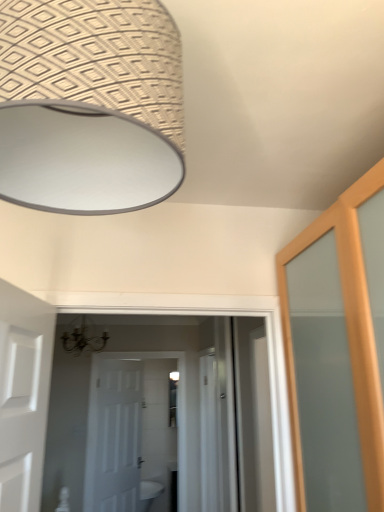
You are a GUI agent. You are given a task and a screenshot of the screen. Output one action in this format:
    pyautogui.click(x=<x>, y=<y>)
    Task: Click on the white glossy sink at lower center
    This screenshot has width=384, height=512.
    Given the screenshot: What is the action you would take?
    pyautogui.click(x=149, y=493)

What do you see at coordinates (149, 493) in the screenshot? This screenshot has width=384, height=512. I see `white glossy sink at lower center` at bounding box center [149, 493].

In the scene shown: Measure the distance between point [211,470] and camera.

Point [211,470] is 3.76 meters from camera.

The height and width of the screenshot is (512, 384). Describe the element at coordinates (118, 436) in the screenshot. I see `white matte door at center` at that location.

Measure the distance between white matte door at center and camera.

They are 3.59 meters apart.

Locate an element on the screen. This screenshot has height=512, width=384. white glossy sink at lower center is located at coordinates (149, 493).

Find the location of a particular element. sink on the left of white glossy screen door at center is located at coordinates (149, 493).

Is point (203, 361) farther from viewer compared to point (144, 461)?

No, (203, 361) is in front of (144, 461).

Is white glossy sink at lower center wider or thinner than white matte door at center?

Considering their sizes, white glossy sink at lower center looks broader than white matte door at center.

How far apart are white glossy sink at lower center and white matte door at center?

The distance of white glossy sink at lower center from white matte door at center is 18.50 inches.

Choose the correct answer: Is white glossy sink at lower center inside white matte door at center or outside it?

white glossy sink at lower center is not inside white matte door at center, it's outside.

Is point (149, 501) farther from camera compared to point (102, 413)?

That is True.

How different are the orientations of white glossy sink at lower center and white glossy screen door at center in degrees?

180 degrees.

Looking at this image, considering the relative sizes of white glossy sink at lower center and white glossy screen door at center in the image provided, is white glossy sink at lower center thinner than white glossy screen door at center?

No.

From the image's perspective, relative to white glossy screen door at center, is white glossy sink at lower center above or below?

white glossy sink at lower center is below white glossy screen door at center.

Is white glossy sink at lower center positioned beyond the bounds of white glossy screen door at center?

white glossy sink at lower center lies outside white glossy screen door at center's area.

In order to click on screen door on the right of white matte door at center in this screenshot , I will do `click(208, 432)`.

Could you tell me if white matte door at center is facing white glossy screen door at center?

Yes, white matte door at center is turned towards white glossy screen door at center.

In terms of size, does white matte door at center appear bigger or smaller than white glossy screen door at center?

white matte door at center is smaller than white glossy screen door at center.

Who is smaller, white matte door at center or white glossy sink at lower center?

white matte door at center.

Is white matte door at center positioned with its back to white glossy sink at lower center?

No, white glossy sink at lower center is not at the back of white matte door at center.

Would you say white glossy screen door at center contains white matte door at center?

No, white matte door at center is not a part of white glossy screen door at center.

Does white glossy screen door at center come behind white matte door at center?

No, it is in front of white matte door at center.

Considering the positions of objects white glossy screen door at center and white matte door at center in the image provided, who is more to the left, white glossy screen door at center or white matte door at center?

white matte door at center.

Identify the location of screen door on the right of white glossy sink at lower center. (208, 432).

What are the coordinates of `door that is on the left side of white glossy sink at lower center` in the screenshot? It's located at point(118,436).

Looking at the image, which one is located further to white glossy screen door at center, white matte door at center or white glossy sink at lower center?

white glossy sink at lower center is positioned further to the anchor white glossy screen door at center.

When comparing their distances from white glossy sink at lower center, does white matte door at center or white glossy screen door at center seem further?

white glossy screen door at center lies further to white glossy sink at lower center than the other object.

Based on their spatial positions, is white glossy screen door at center or white glossy sink at lower center further from white matte door at center?

The object further to white matte door at center is white glossy screen door at center.

When comparing their distances from white glossy sink at lower center, does white glossy screen door at center or white matte door at center seem closer?

white matte door at center lies closer to white glossy sink at lower center than the other object.

Estimate the real-world distances between objects in this image. Which object is closer to white glossy screen door at center, white glossy sink at lower center or white matte door at center?

The object closer to white glossy screen door at center is white matte door at center.

Estimate the real-world distances between objects in this image. Which object is further from white matte door at center, white glossy sink at lower center or white glossy screen door at center?

The object further to white matte door at center is white glossy screen door at center.

Identify the location of door between white glossy screen door at center and white glossy sink at lower center in the front-back direction. The width and height of the screenshot is (384, 512). (118, 436).